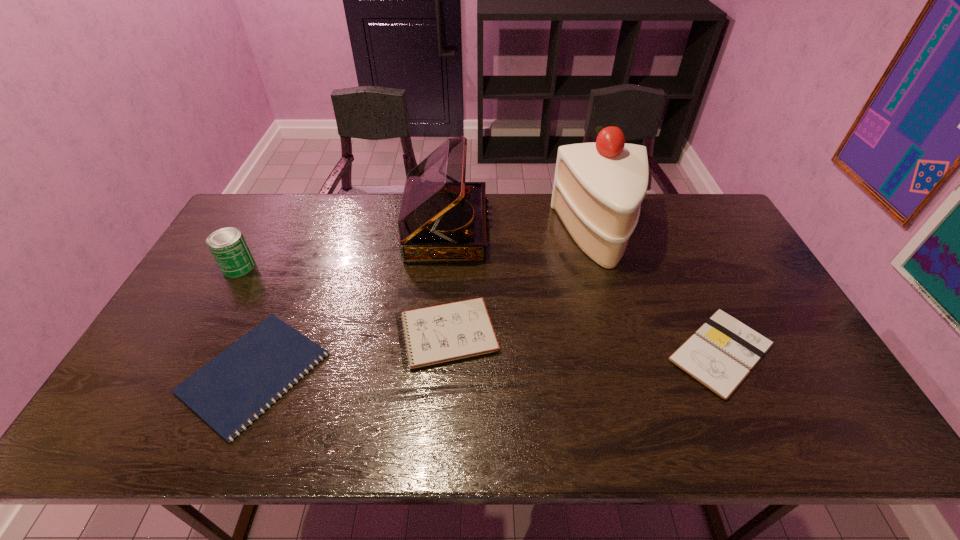
Locate which notepad ranks second in proximity to the third tallest object. Please provide its 2D coordinates. Your answer should be formatted as a tuple, i.e. [(x, y)], where the tuple contains the x and y coordinates of a point satisfying the conditions above.

[(442, 333)]

You are a GUI agent. You are given a task and a screenshot of the screen. Output one action in this format:
    pyautogui.click(x=<x>, y=<y>)
    Task: Click on the vacant space that satisfies the following two spatial constraints: 1. on the front-facing side of the record player; 2. on the back side of the rightmost notepad
    
    Given the screenshot: What is the action you would take?
    pyautogui.click(x=436, y=353)

This screenshot has height=540, width=960. Identify the location of free space that satisfies the following two spatial constraints: 1. on the back side of the can; 2. on the right side of the tallest object. (256, 236).

Locate an element on the screen. Image resolution: width=960 pixels, height=540 pixels. free space that satisfies the following two spatial constraints: 1. on the front-facing side of the record player; 2. on the back side of the second shortest object is located at coordinates (436, 353).

I want to click on vacant point that satisfies the following two spatial constraints: 1. on the front-facing side of the fourth tallest object; 2. on the left side of the record player, so click(x=438, y=334).

Locate an element on the screen. Image resolution: width=960 pixels, height=540 pixels. free location that satisfies the following two spatial constraints: 1. on the front-facing side of the fifth shortest object; 2. on the left side of the cake is located at coordinates (446, 236).

Locate an element on the screen. The image size is (960, 540). free space that satisfies the following two spatial constraints: 1. on the front side of the can; 2. on the left side of the shortest object is located at coordinates [x=180, y=373].

Where is `vacant point that satisfies the following two spatial constraints: 1. on the back side of the rightmost notepad; 2. on the left side of the shortest notepad`? vacant point that satisfies the following two spatial constraints: 1. on the back side of the rightmost notepad; 2. on the left side of the shortest notepad is located at coordinates (262, 353).